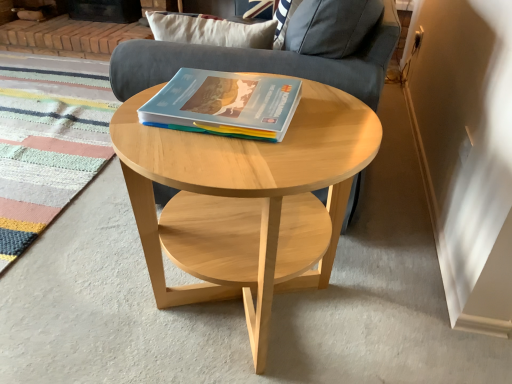
At what (x,y) coordinates should I click in order to perform the action: click on vacant area that lies to the right of matte plastic book at center. Please return your answer as a coordinate pair (x, y). Looking at the image, I should click on (331, 124).